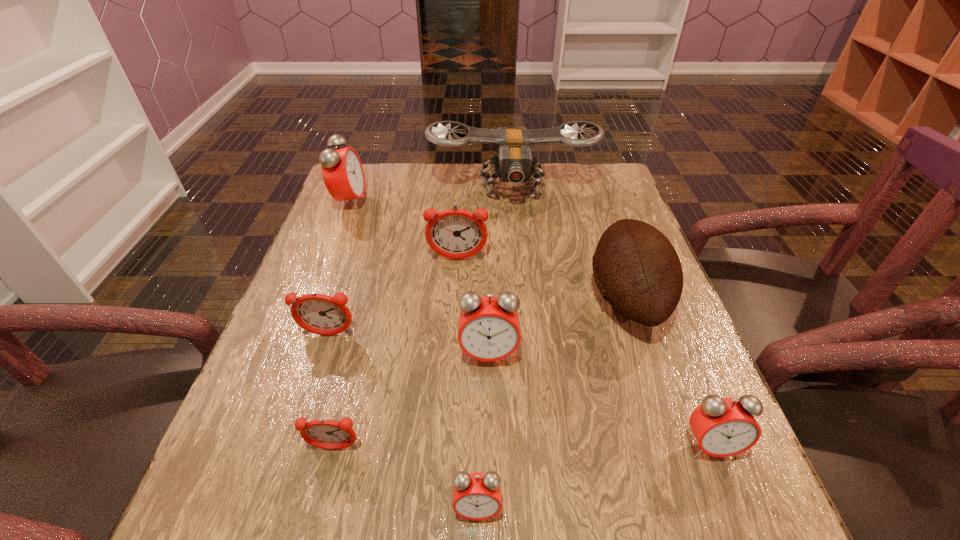
The width and height of the screenshot is (960, 540). Identify the location of vacant space located 0.200m on the front-facing side of the second smallest reddish-pink alarm clock. (297, 435).

Locate an element on the screen. The image size is (960, 540). vacant position located 0.060m on the front-facing side of the second smallest red alarm clock is located at coordinates (733, 502).

This screenshot has width=960, height=540. What are the coordinates of `free spot located 0.050m on the front-facing side of the nearest reddish-pink alarm clock` in the screenshot? It's located at (325, 487).

The width and height of the screenshot is (960, 540). Find the location of `drone that is at the far edge`. drone that is at the far edge is located at coordinates (514, 163).

Identify the location of alarm clock located at the far edge. (342, 171).

The image size is (960, 540). I want to click on object positioned at the near edge, so click(x=476, y=496).

Identify the location of drone that is at the right edge. The height and width of the screenshot is (540, 960). (514, 163).

Identify the location of football at the right edge. (636, 268).

This screenshot has height=540, width=960. I want to click on alarm clock present at the right edge, so point(723,427).

Find the location of a particular element. object that is positioned at the far left corner is located at coordinates (342, 171).